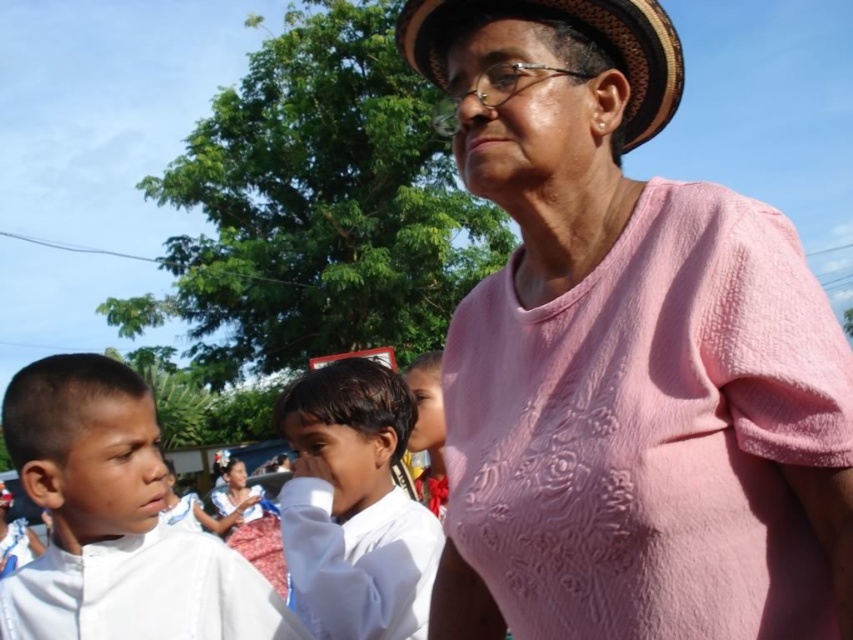
Question: Which point is farther from the camera taking this photo?

Choices:
 (A) (247, 557)
 (B) (627, 104)
 (C) (717, 444)

Answer: (A)

Question: Is pink textured shirt at upper right thinner than white cotton shirt at left?

Choices:
 (A) yes
 (B) no

Answer: (A)

Question: Does white cotton shirt at left appear on the right side of red floral dress at center?

Choices:
 (A) yes
 (B) no

Answer: (A)

Question: Which object is closer to the camera taking this photo?

Choices:
 (A) white cotton shirt at left
 (B) white cotton shirt at center

Answer: (A)

Question: Which object is positioned farthest from the woven straw hat at upper center?

Choices:
 (A) white cotton shirt at center
 (B) pink textured shirt at upper right
 (C) red floral dress at center

Answer: (C)

Question: Is white cotton shirt at left smaller than white cotton shirt at center?

Choices:
 (A) yes
 (B) no

Answer: (B)